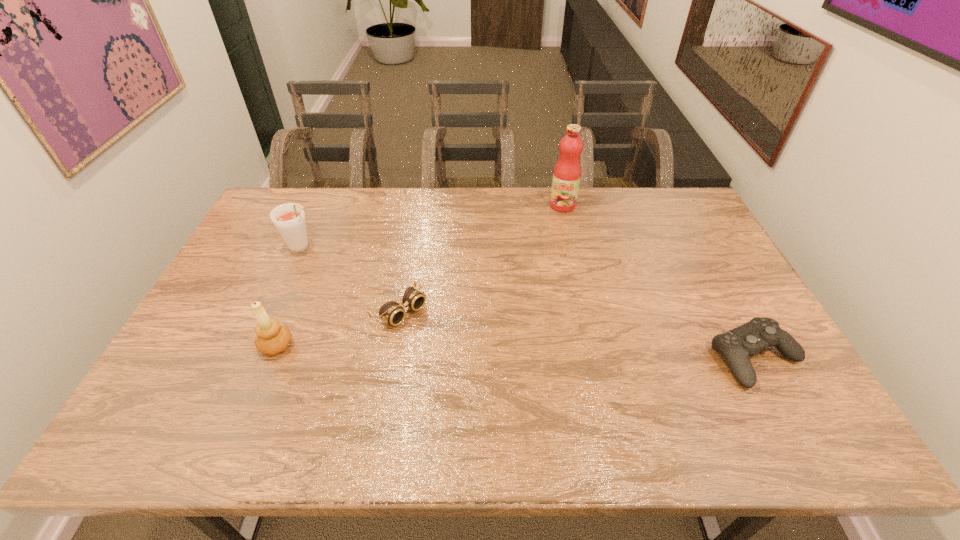
This screenshot has width=960, height=540. Find the location of `vacant space on the desktop that is between the candle_holder and the rightmost object and is positioned on the front label of the tallest object`. vacant space on the desktop that is between the candle_holder and the rightmost object and is positioned on the front label of the tallest object is located at coordinates (474, 350).

I want to click on vacant space on the desktop that is between the candle_holder and the second shortest object and is positioned on the drink side of the second farthest object, so click(447, 350).

Where is `free space on the desktop that is between the candle_holder and the rightmost object and is positioned through the lenses of the shortest object`? The height and width of the screenshot is (540, 960). free space on the desktop that is between the candle_holder and the rightmost object and is positioned through the lenses of the shortest object is located at coordinates (449, 350).